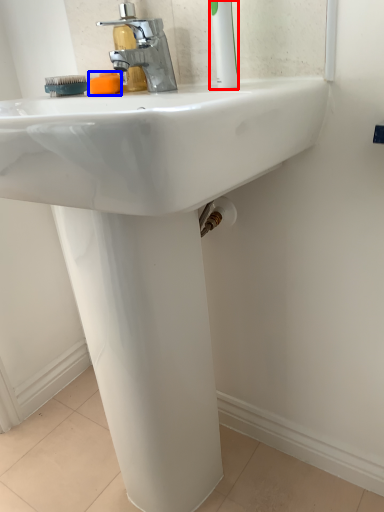
Question: Which object appears closest to the camera in this image, toothbrush (highlighted by a red box) or soap (highlighted by a blue box)?

Choices:
 (A) toothbrush
 (B) soap

Answer: (A)